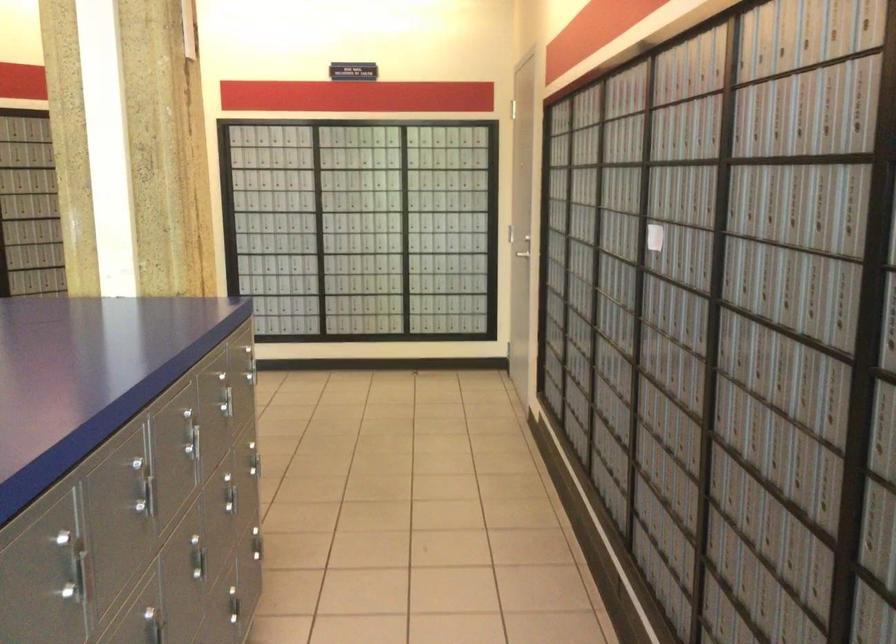
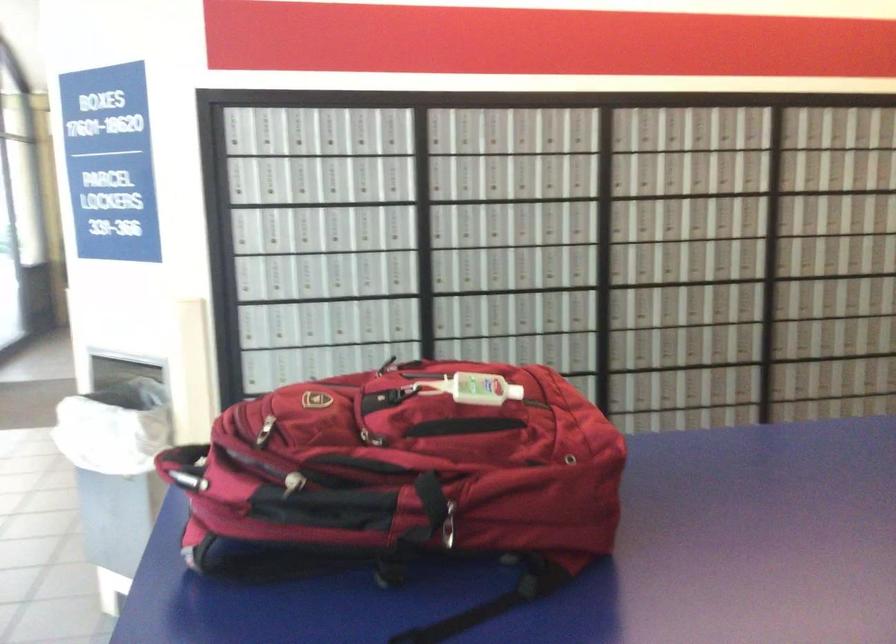
Question: The camera is either moving clockwise (left) or counter-clockwise (right) around the object. The first image is from the beginning of the video and the second image is from the end. Is the camera moving left or right when shooting the video?

Choices:
 (A) Left
 (B) Right

Answer: (B)